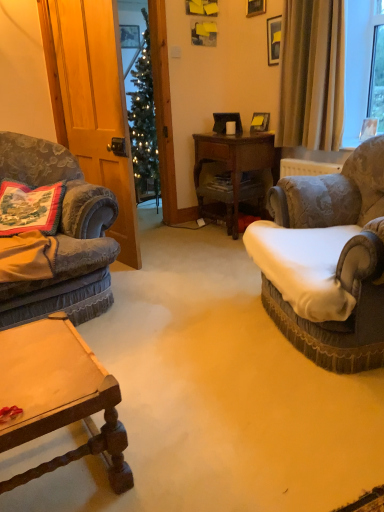
I want to click on vacant point to the right of velvet fabric armchair at left, which is counted as the 1th chair, starting from the left, so click(x=185, y=294).